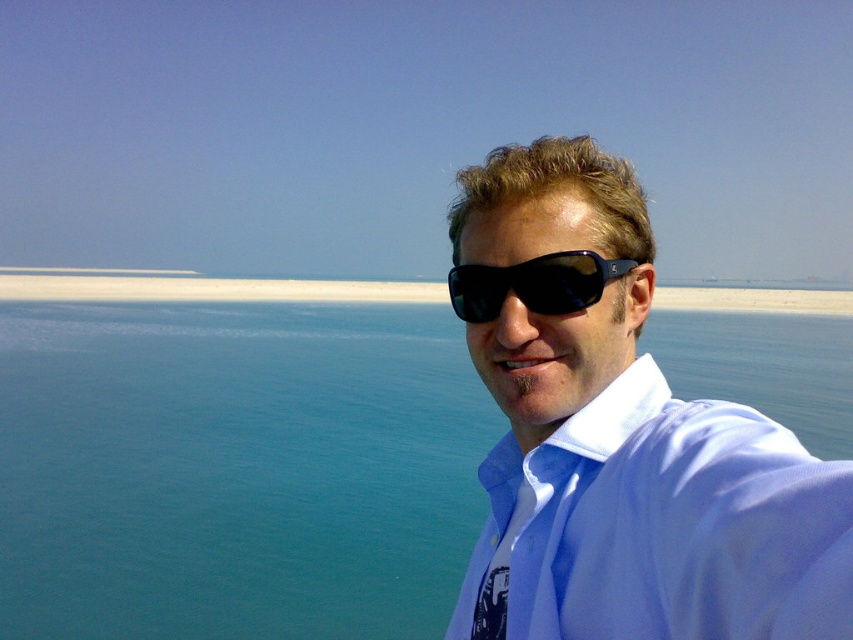
From the picture: You are a photographer trying to capture the perfect shot of the blue water at center and the matte black sunglasses at upper right. Since you want both elements to be equally visible in the photo, would adjusting the camera angle to focus more on the wider object help achieve this balance?

The blue water at center is wider than the matte black sunglasses at upper right. To balance visibility, focus more on the wider blue water at center to ensure both elements are equally prominent in the photo.

You are a photographer trying to capture the perfect shot of the blue water at center and the black plastic sunglasses at center. Based on their sizes in the frame, which object should you focus on first if you want to ensure both are in focus?

The blue water at center has a larger width than the black plastic sunglasses at center, so focusing on the blue water at center first would ensure both are in focus since it occupies more space in the frame.